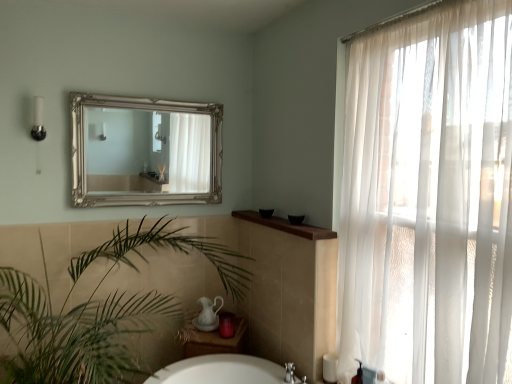
The height and width of the screenshot is (384, 512). Identify the location of blank space situated above silver ornate mirror at upper center (from a real-world perspective). (140, 99).